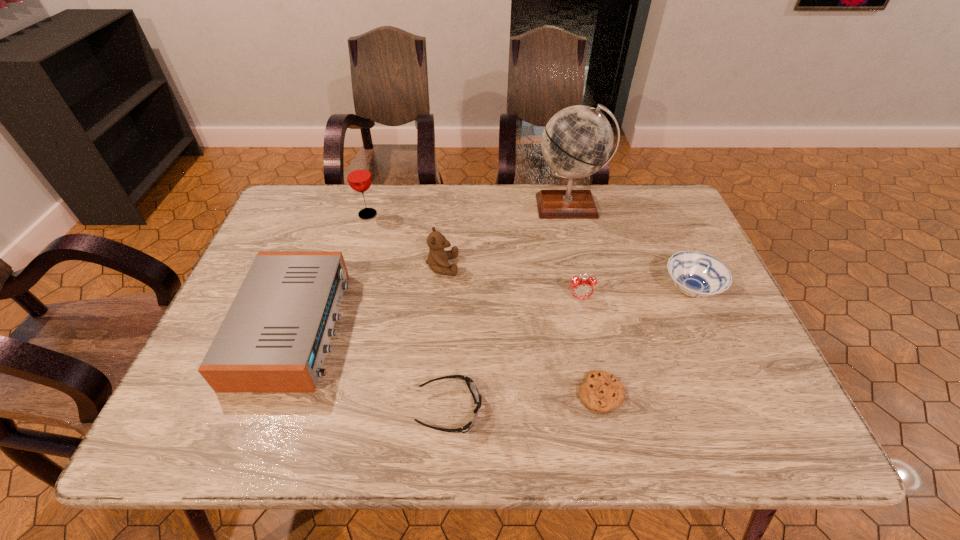
The height and width of the screenshot is (540, 960). I want to click on cookie situated at the near edge, so click(x=601, y=392).

Identify the location of object that is at the left edge. The height and width of the screenshot is (540, 960). (274, 338).

Locate an element on the screen. This screenshot has width=960, height=540. object located at the right edge is located at coordinates (696, 274).

In the image, there is a desktop. Identify the location of blank space at the far edge. This screenshot has width=960, height=540. (531, 212).

In the image, there is a desktop. Where is `vacant space at the near edge`? vacant space at the near edge is located at coordinates (312, 426).

In the image, there is a desktop. At what (x,y) coordinates should I click in order to perform the action: click on vacant region at the left edge. Please return your answer as a coordinate pair (x, y). The image size is (960, 540). Looking at the image, I should click on (310, 240).

Find the location of a particular element. free region at the right edge of the desktop is located at coordinates (661, 238).

The image size is (960, 540). In the image, there is a desktop. Find the location of `vacant area at the far left corner`. vacant area at the far left corner is located at coordinates (284, 210).

Find the location of a particular element. Image resolution: width=960 pixels, height=540 pixels. vacant space at the near left corner is located at coordinates (186, 408).

Identify the location of vacant space at the far right corner of the desktop. This screenshot has width=960, height=540. (634, 192).